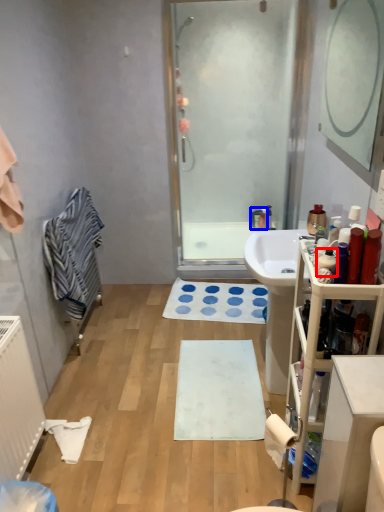
Question: Which object is further to the camera taking this photo, toiletry (highlighted by a red box) or faucet (highlighted by a blue box)?

Choices:
 (A) toiletry
 (B) faucet

Answer: (B)